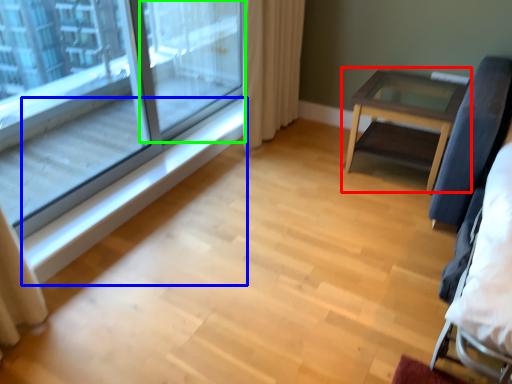
Question: Based on their relative distances, which object is farther from table (highlighted by a red box)? Choose from window sill (highlighted by a blue box) and screen door (highlighted by a green box).

Choices:
 (A) window sill
 (B) screen door

Answer: (B)